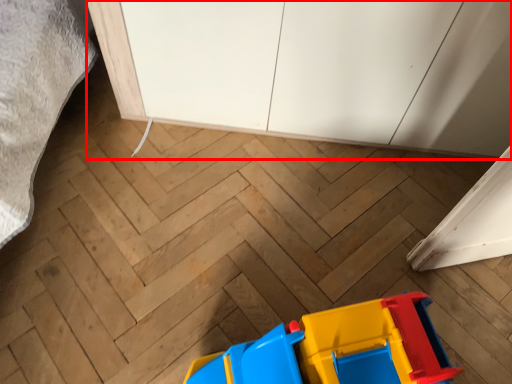
Question: From the image's perspective, where is cabinetry (annotated by the red box) located in relation to toy in the image?

Choices:
 (A) above
 (B) below

Answer: (A)